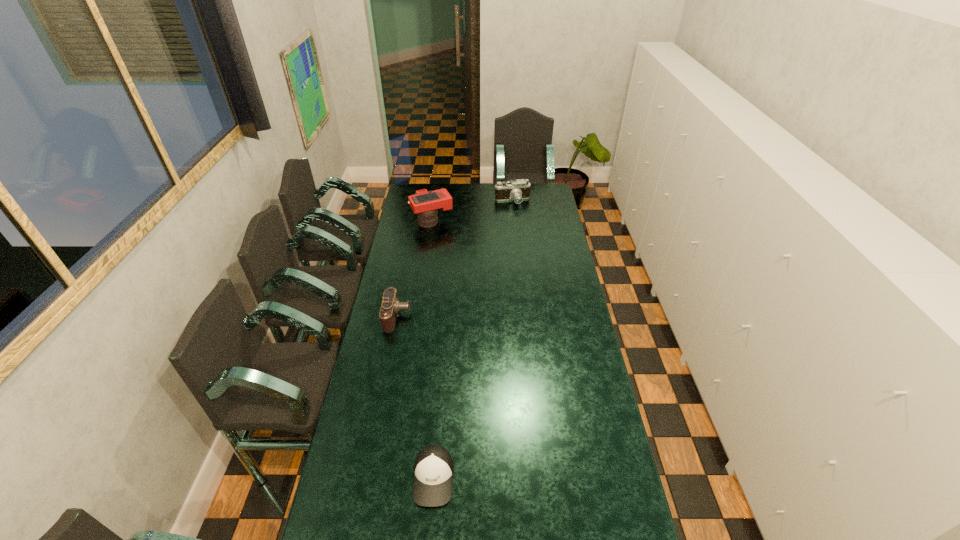
Locate an element on the screen. the second nearest camera is located at coordinates pos(424,203).

Locate an element on the screen. The image size is (960, 540). the tallest camera is located at coordinates (424, 203).

At what (x,y) coordinates should I click in order to perform the action: click on the farthest object. Please return your answer as a coordinate pair (x, y). The height and width of the screenshot is (540, 960). Looking at the image, I should click on (517, 190).

The image size is (960, 540). I want to click on the rightmost object, so pyautogui.click(x=517, y=190).

The height and width of the screenshot is (540, 960). In order to click on the shortest camera in this screenshot , I will do `click(390, 307)`.

This screenshot has height=540, width=960. What are the coordinates of `the nearest camera` in the screenshot? It's located at (390, 307).

Identify the location of the nearest object. (433, 480).

Where is `free location located on the back of the tallest object`? This screenshot has height=540, width=960. free location located on the back of the tallest object is located at coordinates (437, 192).

The height and width of the screenshot is (540, 960). What are the coordinates of `free location located 0.130m at the lens of the rightmost object` in the screenshot? It's located at (515, 220).

The width and height of the screenshot is (960, 540). Find the location of `vacant space located 0.240m on the front-facing side of the nearest camera`. vacant space located 0.240m on the front-facing side of the nearest camera is located at coordinates (464, 316).